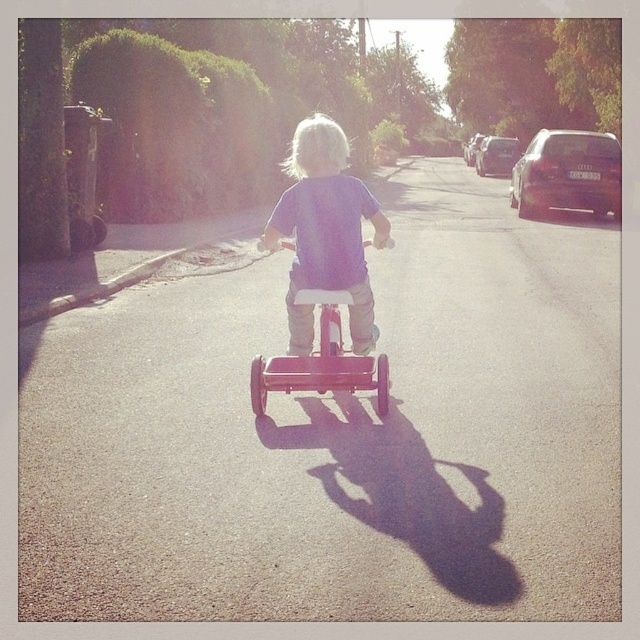
You are a pedestrian standing on the sidewalk and see the purple matte shirt at center and the metallic silver car at right. Which object is nearer to you?

The purple matte shirt at center is closer to the viewer than the metallic silver car at right.

You are standing on the sidewalk and see two points marked on the street ahead of you. The first point is at coordinates point (602, 138) and the second point is at point (484, 172). Which point is closer to you?

Point (602, 138) is closer to the viewer than point (484, 172).